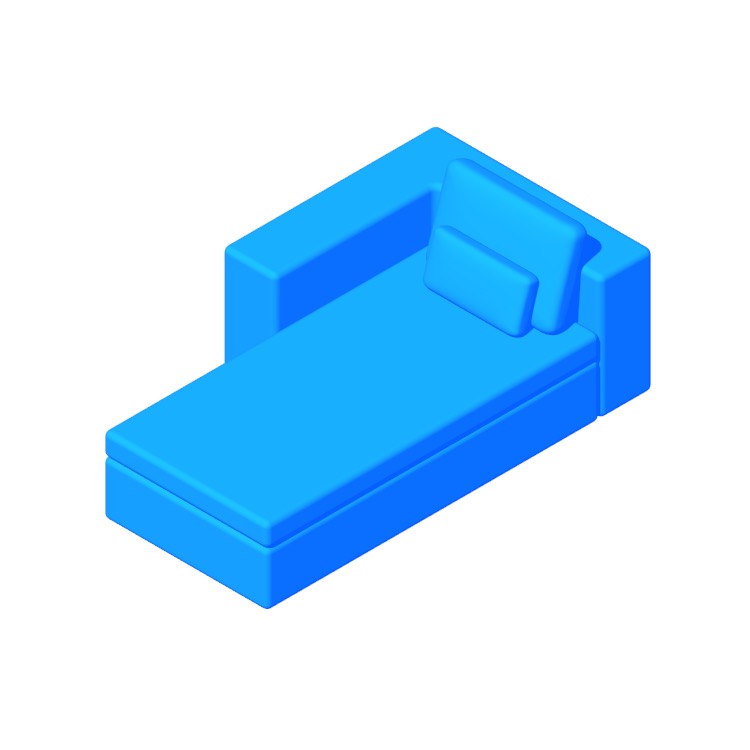
At what (x,y) coordinates should I click in order to perform the action: click on small pillow. Please return your answer as a coordinate pair (x, y). The width and height of the screenshot is (750, 750). Looking at the image, I should click on (490, 303).